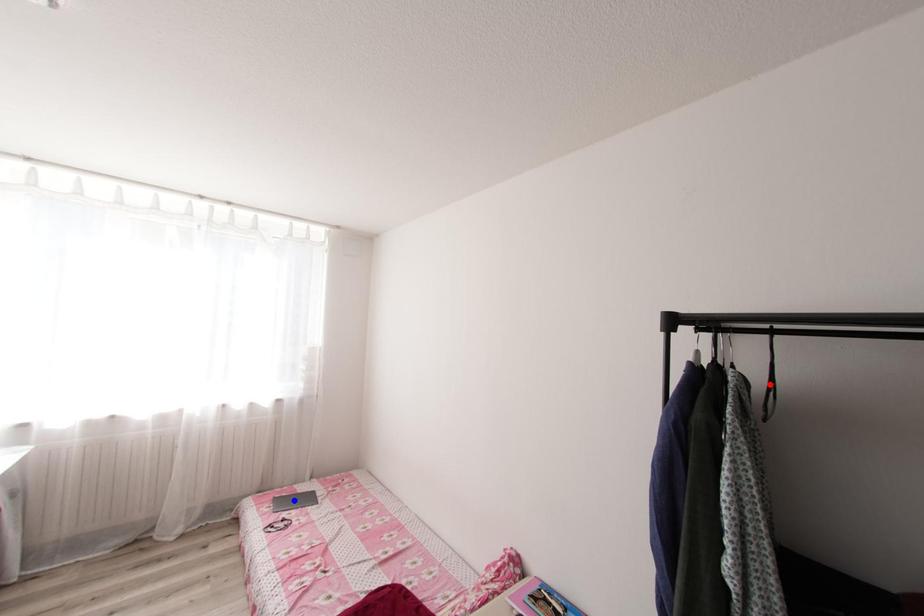
Question: In the image, two points are highlighted. Which point is nearer to the camera? Reply with the corresponding letter.

Choices:
 (A) blue point
 (B) red point

Answer: (B)